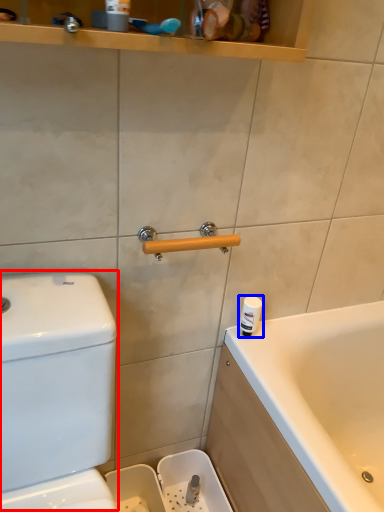
Question: Among these objects, which one is farthest to the camera, water tank (highlighted by a red box) or toiletry (highlighted by a blue box)?

Choices:
 (A) water tank
 (B) toiletry

Answer: (B)